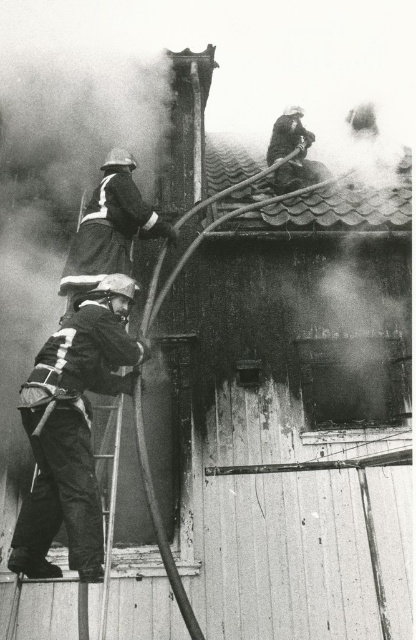
You are a photographer trying to capture a clear shot of both the black matte uniform at lower left and the metallic silver ladder at lower center. Based on their sizes in the image, which object would appear taller in the photograph?

The black matte uniform at lower left appears taller than the metallic silver ladder at lower center in the photograph.